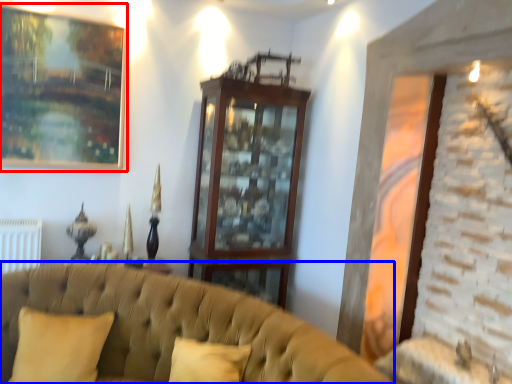
Question: Which of the following is the farthest to the observer, picture frame (highlighted by a red box) or studio couch (highlighted by a blue box)?

Choices:
 (A) picture frame
 (B) studio couch

Answer: (A)